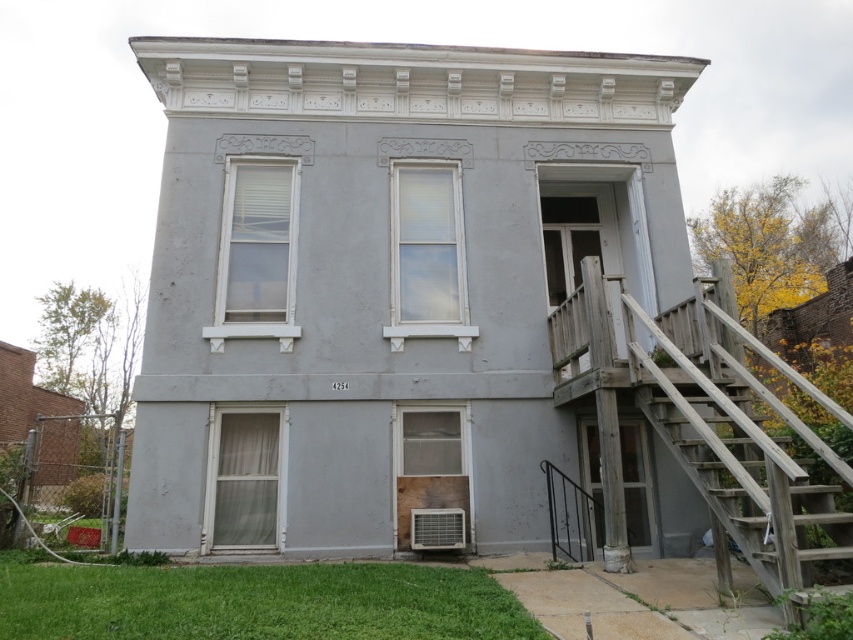
Is point (849, 419) behind point (564, 552)?

No, (849, 419) is closer to viewer.

In the scene shown: Can you confirm if weathered wood stairs at right is thinner than black metal rail at lower right?

No.

Find the location of `weathered wood stairs at right`. weathered wood stairs at right is located at coordinates (741, 440).

Where is `weathered wood stairs at right`? weathered wood stairs at right is located at coordinates (741, 440).